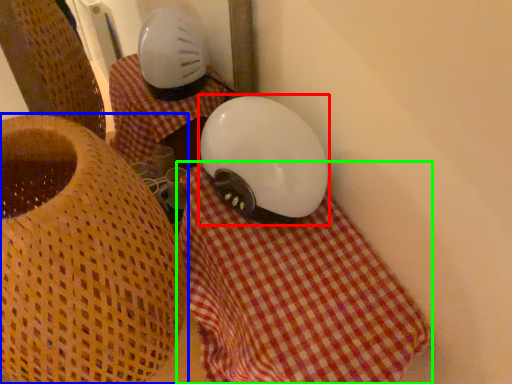
Question: Which object is the closest to the helmet (highlighted by a red box)? Choose among these: furniture (highlighted by a blue box) or blanket (highlighted by a green box).

Choices:
 (A) furniture
 (B) blanket

Answer: (B)